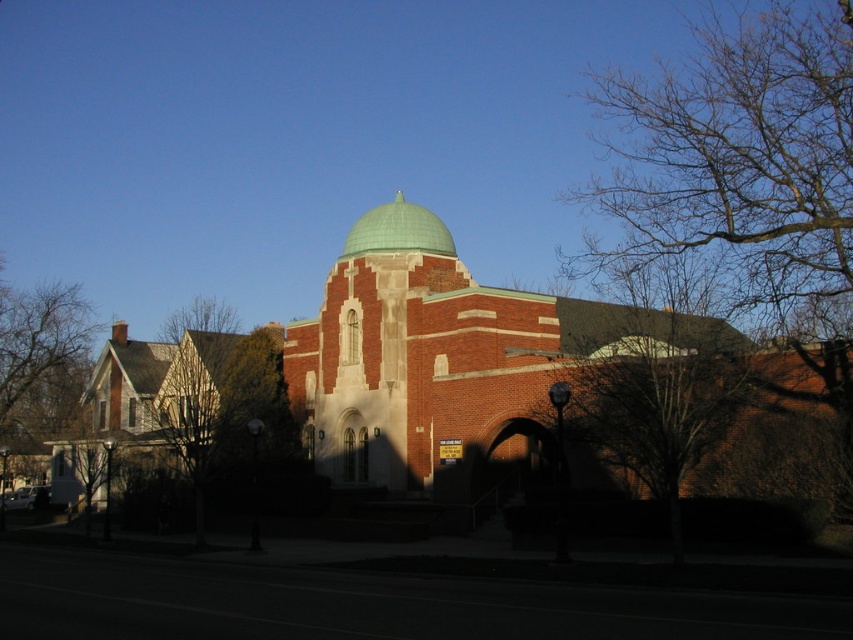
Question: Which object is farther from the camera taking this photo?

Choices:
 (A) brown wood tree at left
 (B) bare branches at upper right
 (C) green metallic dome at center
 (D) brick building at center

Answer: (A)

Question: Is brick building at center wider than brown wood tree at left?

Choices:
 (A) no
 (B) yes

Answer: (A)

Question: Which object is closer to the camera taking this photo?

Choices:
 (A) brown wood tree at left
 (B) bare branches at upper right
 (C) green metallic dome at center
 (D) brick building at center

Answer: (D)

Question: Is brown wood tree at left positioned in front of green metallic dome at center?

Choices:
 (A) yes
 (B) no

Answer: (B)

Question: Does brick building at center appear on the left side of brown wood tree at left?

Choices:
 (A) no
 (B) yes

Answer: (A)

Question: Which point is farther from the camera taking this photo?

Choices:
 (A) (322, 406)
 (B) (404, 237)
 (C) (16, 349)

Answer: (C)